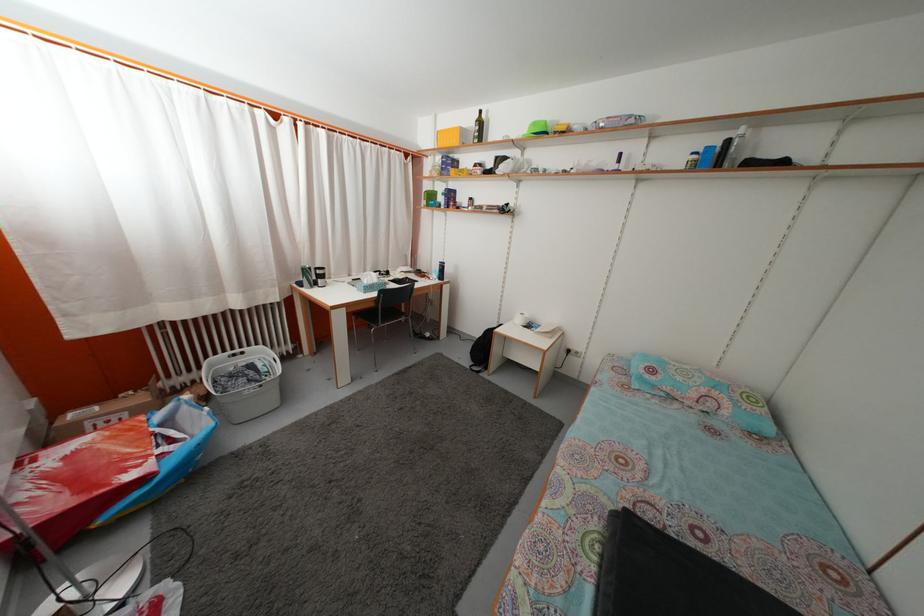
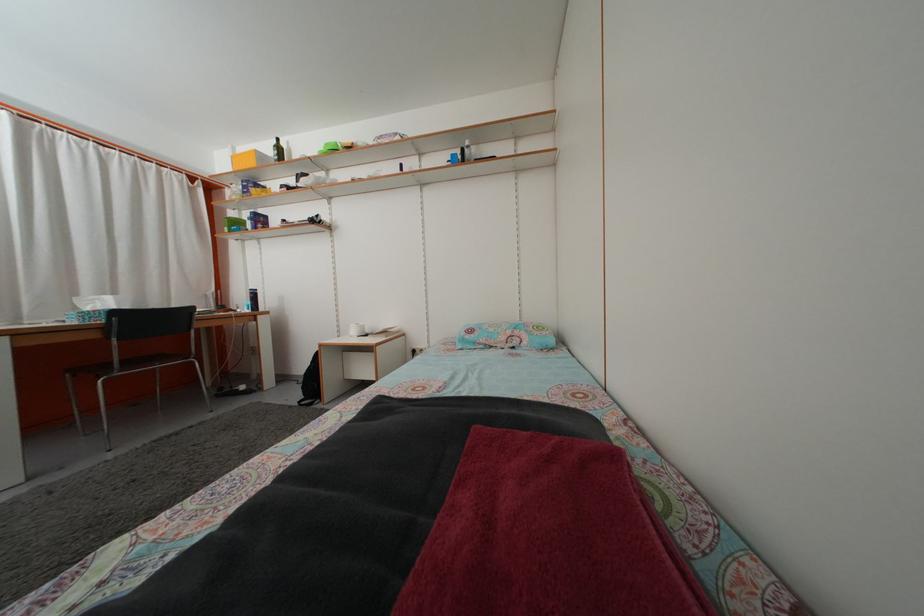
Question: Based on the continuous images, in which direction is the camera rotating? Reply with the corresponding letter.

Choices:
 (A) Left
 (B) Right
 (C) Up
 (D) Down

Answer: (B)